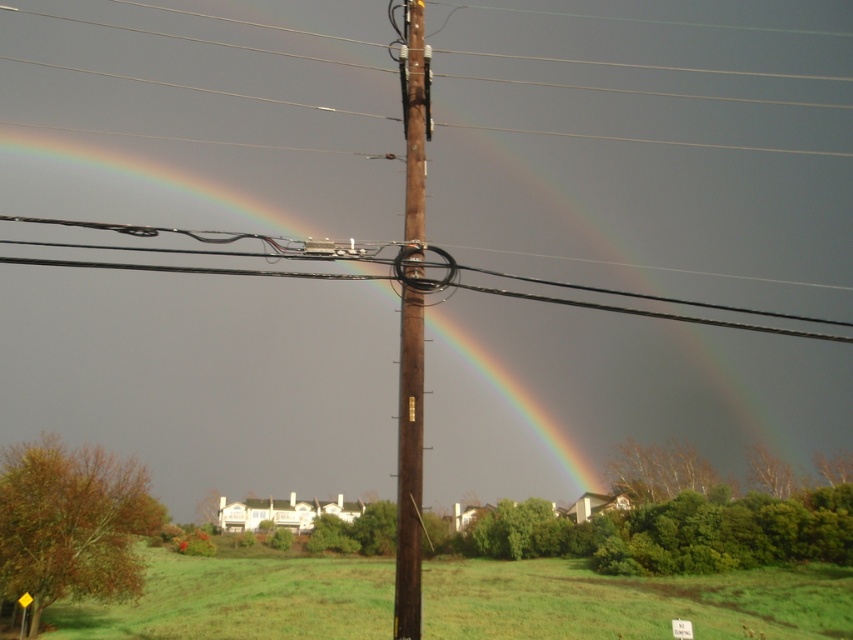
Question: Can you confirm if brown wooden telegraph pole at center is thinner than black wire at center?

Choices:
 (A) yes
 (B) no

Answer: (A)

Question: Is brown wooden telegraph pole at center closer to camera compared to black wire at center?

Choices:
 (A) no
 (B) yes

Answer: (B)

Question: Which object is farther from the camera taking this photo?

Choices:
 (A) black wire at center
 (B) brown wooden telegraph pole at center

Answer: (A)

Question: Among these objects, which one is farthest from the camera?

Choices:
 (A) black wire at center
 (B) brown wooden telegraph pole at center

Answer: (A)

Question: In this image, where is brown wooden telegraph pole at center located relative to black wire at center?

Choices:
 (A) below
 (B) above

Answer: (A)